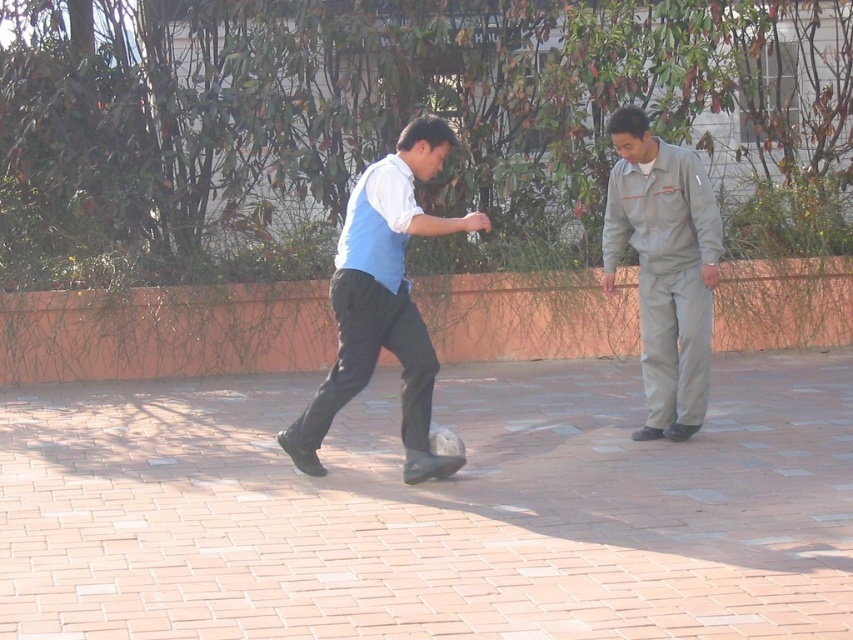
How far apart are matte blue vest at center and gray uniform at right?

They are 1.66 meters apart.

Is matte blue vest at center smaller than gray uniform at right?

No.

Which is in front, point (383, 180) or point (653, 172)?

Point (383, 180)

I want to click on matte blue vest at center, so click(x=383, y=301).